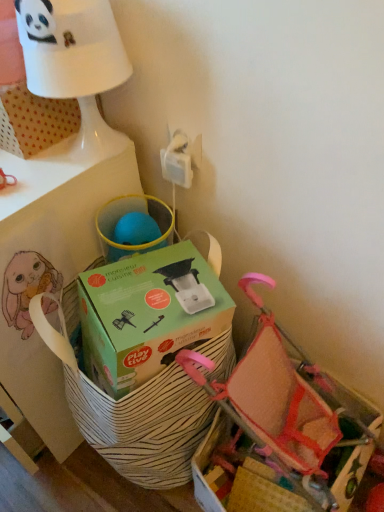
Image resolution: width=384 pixels, height=512 pixels. Describe the element at coordinates (65, 63) in the screenshot. I see `white glossy table lamp at upper left` at that location.

What do you see at coordinates (277, 399) in the screenshot? I see `pink mesh baby carriage at lower right` at bounding box center [277, 399].

Find the location of a particular element. green cardboard box at center is located at coordinates (148, 314).

The height and width of the screenshot is (512, 384). In order to click on white glossy table lamp at upper left in this screenshot , I will do `click(65, 63)`.

From a real-world perspective, who is located lower, white glossy table lamp at upper left or green cardboard box at center?

green cardboard box at center, from a real-world perspective.

Is white glossy table lamp at upper left facing away from green cardboard box at center?

white glossy table lamp at upper left is not turned away from green cardboard box at center.

Is white glossy table lamp at upper left not within green cardboard box at center?

white glossy table lamp at upper left is positioned outside green cardboard box at center.

Measure the distance from white glossy table lamp at upper left to green cardboard box at center.

white glossy table lamp at upper left is 14.76 inches away from green cardboard box at center.

From the image's perspective, is green cardboard box at center located beneath pink mesh baby carriage at lower right?

Incorrect, from the image's perspective, green cardboard box at center is higher than pink mesh baby carriage at lower right.

Looking at this image, which object is positioned more to the right, green cardboard box at center or pink mesh baby carriage at lower right?

From the viewer's perspective, pink mesh baby carriage at lower right appears more on the right side.

Would you consider green cardboard box at center to be distant from pink mesh baby carriage at lower right?

No, green cardboard box at center is in close proximity to pink mesh baby carriage at lower right.

At what (x,y) coordinates should I click in order to perform the action: click on baby carriage that appears below the white glossy table lamp at upper left (from a real-world perspective). Please return your answer as a coordinate pair (x, y). The image size is (384, 512). Looking at the image, I should click on (277, 399).

Relative to pink mesh baby carriage at lower right, is white glossy table lamp at upper left in front or behind?

Visually, white glossy table lamp at upper left is located in front of pink mesh baby carriage at lower right.

Is white glossy table lamp at upper left inside or outside of pink mesh baby carriage at lower right?

white glossy table lamp at upper left is not inside pink mesh baby carriage at lower right, it's outside.

Considering the sizes of white glossy table lamp at upper left and pink mesh baby carriage at lower right in the image, is white glossy table lamp at upper left wider or thinner than pink mesh baby carriage at lower right?

Clearly, white glossy table lamp at upper left has less width compared to pink mesh baby carriage at lower right.

Is white matte table at upper left smaller than green cardboard box at center?

Incorrect, white matte table at upper left is not smaller in size than green cardboard box at center.

Is point (38, 277) positioned before point (83, 304)?

No, (38, 277) is further to viewer.

From the image's perspective, is white matte table at upper left below green cardboard box at center?

Actually, white matte table at upper left appears above green cardboard box at center in the image.

Is white matte table at upper left outside of green cardboard box at center?

white matte table at upper left is positioned outside green cardboard box at center.

From a real-world perspective, which object stands above the other?

white glossy table lamp at upper left, from a real-world perspective.

Considering the relative sizes of green cardboard box at center and white glossy table lamp at upper left in the image provided, is green cardboard box at center smaller than white glossy table lamp at upper left?

Incorrect, green cardboard box at center is not smaller in size than white glossy table lamp at upper left.

Considering the sizes of objects green cardboard box at center and white glossy table lamp at upper left in the image provided, who is shorter, green cardboard box at center or white glossy table lamp at upper left?

green cardboard box at center is shorter.

From the image's perspective, does green cardboard box at center appear lower than white glossy table lamp at upper left?

Yes, from the image's perspective, green cardboard box at center is beneath white glossy table lamp at upper left.

Based on the photo, which is more to the right, pink mesh baby carriage at lower right or white glossy table lamp at upper left?

From the viewer's perspective, pink mesh baby carriage at lower right appears more on the right side.

Is pink mesh baby carriage at lower right spatially inside white glossy table lamp at upper left, or outside of it?

pink mesh baby carriage at lower right exists outside the volume of white glossy table lamp at upper left.

Which is closer to the camera, [266,397] or [39,28]?

Point [266,397] appears to be farther away from the viewer than point [39,28].

Is white matte table at upper left touching pink mesh baby carriage at lower right?

No, white matte table at upper left is not next to pink mesh baby carriage at lower right.

Which of these two, white matte table at upper left or pink mesh baby carriage at lower right, is thinner?

With smaller width is pink mesh baby carriage at lower right.

Which is correct: white matte table at upper left is inside pink mesh baby carriage at lower right, or outside of it?

white matte table at upper left is located beyond the bounds of pink mesh baby carriage at lower right.

Can you confirm if white matte table at upper left is taller than pink mesh baby carriage at lower right?

Correct, white matte table at upper left is much taller as pink mesh baby carriage at lower right.

Locate an element on the screen. This screenshot has height=512, width=384. table lamp that is on the left side of green cardboard box at center is located at coordinates (65, 63).

Find the location of a particular element. This screenshot has height=512, width=384. baby carriage that is behind the green cardboard box at center is located at coordinates (277, 399).

Based on their spatial positions, is pink mesh baby carriage at lower right or white glossy table lamp at upper left further from green cardboard box at center?

Based on the image, white glossy table lamp at upper left appears to be further to green cardboard box at center.

From the image, which object appears to be farther from pink mesh baby carriage at lower right, white glossy table lamp at upper left or white matte table at upper left?

white glossy table lamp at upper left.

When comparing their distances from white glossy table lamp at upper left, does pink mesh baby carriage at lower right or white matte table at upper left seem closer?

The object closer to white glossy table lamp at upper left is white matte table at upper left.

From the image, which object appears to be farther from white matte table at upper left, pink mesh baby carriage at lower right or white glossy table lamp at upper left?

The object further to white matte table at upper left is pink mesh baby carriage at lower right.

Consider the image. Considering their positions, is white glossy table lamp at upper left positioned further to white matte table at upper left than pink mesh baby carriage at lower right?

pink mesh baby carriage at lower right lies further to white matte table at upper left than the other object.

When comparing their distances from green cardboard box at center, does white glossy table lamp at upper left or white matte table at upper left seem closer?

Based on the image, white matte table at upper left appears to be nearer to green cardboard box at center.

Which object lies nearer to the anchor point green cardboard box at center, white matte table at upper left or pink mesh baby carriage at lower right?

pink mesh baby carriage at lower right.

When comparing their distances from pink mesh baby carriage at lower right, does green cardboard box at center or white glossy table lamp at upper left seem closer?

Among the two, green cardboard box at center is located nearer to pink mesh baby carriage at lower right.

Identify the location of box that lies between white glossy table lamp at upper left and pink mesh baby carriage at lower right from top to bottom. (148, 314).

You are a GUI agent. You are given a task and a screenshot of the screen. Output one action in this format:
    pyautogui.click(x=<x>, y=<y>)
    Task: Click on the table lamp between white matte table at upper left and green cardboard box at center
    This screenshot has height=512, width=384.
    Given the screenshot: What is the action you would take?
    pyautogui.click(x=65, y=63)

Find the location of `box between white matte table at upper left and pink mesh baby carriage at lower right from left to right`. box between white matte table at upper left and pink mesh baby carriage at lower right from left to right is located at coordinates pyautogui.click(x=148, y=314).

Identify the location of table between white glossy table lamp at upper left and pink mesh baby carriage at lower right vertically. This screenshot has width=384, height=512. (48, 273).